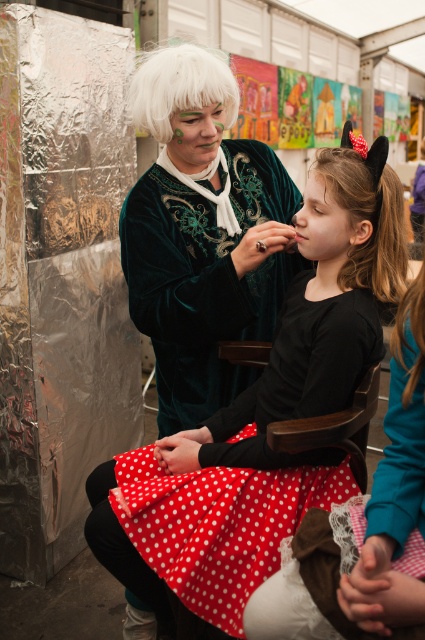
Does polka dot fabric dress at center have a smaller size compared to brown silky hair at right?

No, polka dot fabric dress at center is not smaller than brown silky hair at right.

Is polka dot fabric dress at center positioned in front of brown silky hair at right?

No, polka dot fabric dress at center is behind brown silky hair at right.

Is point (379, 214) more distant than point (404, 404)?

Yes.

Locate an element on the screen. The width and height of the screenshot is (425, 640). polka dot fabric dress at center is located at coordinates (317, 316).

Does brown silky hair at center appear under white fluffy wig at upper center?

Correct, brown silky hair at center is located below white fluffy wig at upper center.

Does point (391, 232) lie behind point (139, 90)?

No, (391, 232) is closer to viewer.

Where is `brown silky hair at center`? This screenshot has width=425, height=640. brown silky hair at center is located at coordinates (368, 216).

Is point (193, 323) more distant than point (424, 301)?

Yes, it is.

Can you confirm if velvet green dress at center is thinner than brown silky hair at right?

No, velvet green dress at center is not thinner than brown silky hair at right.

Locate an element on the screen. This screenshot has height=640, width=425. velvet green dress at center is located at coordinates (201, 234).